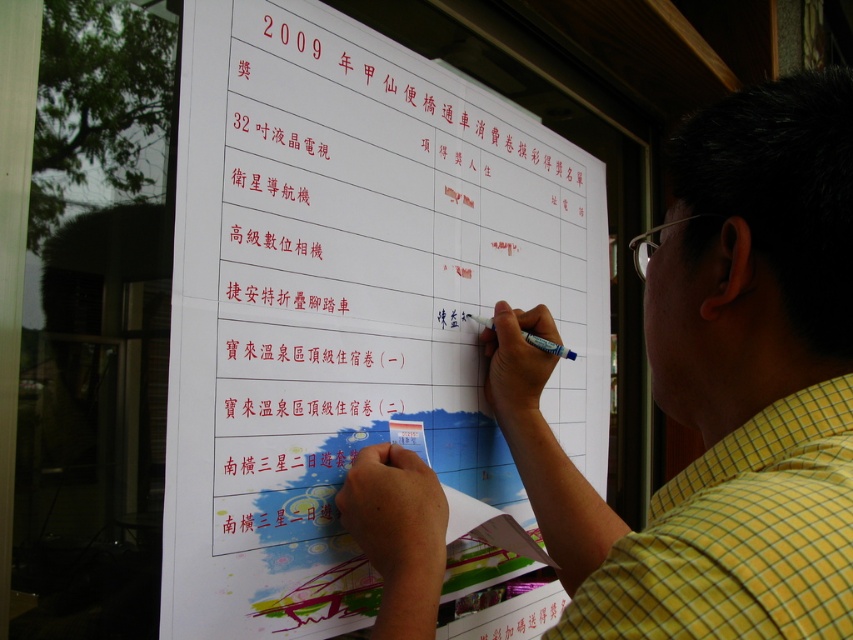
You are standing in front of the whiteboard and notice two yellow checkered shirts. Which one is closer to you, the yellow checkered shirt at upper right or the yellow checkered shirt at right?

The yellow checkered shirt at upper right is closer to you because it is further to the viewer than the yellow checkered shirt at right.

You are standing in front of the whiteboard and notice two items. One is the white paper at center and the other is the yellow checkered shirt at upper right. Based on their positions, which item is closer to the top of the image?

The white paper at center is located above the yellow checkered shirt at upper right, so the white paper at center is closer to the top of the image.